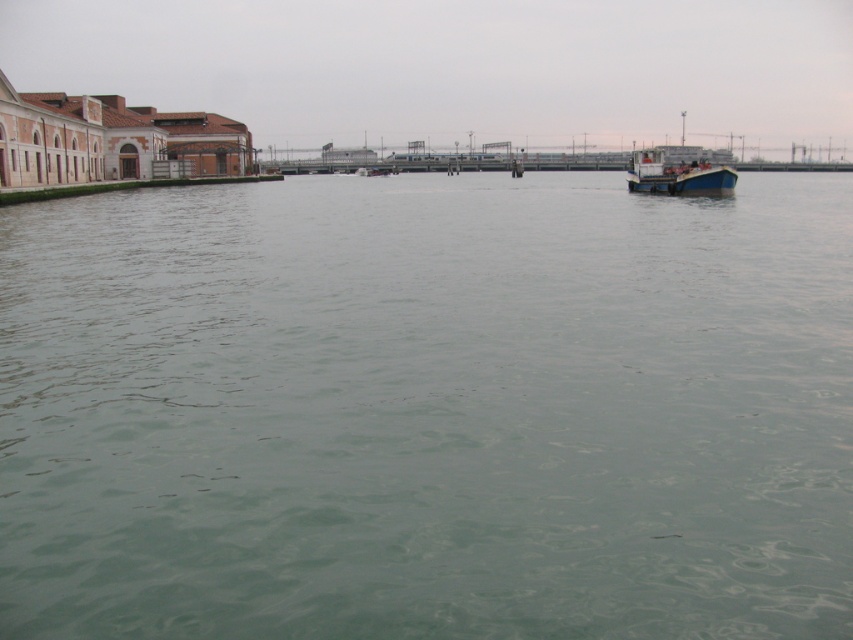
Question: Can you confirm if green water at center is thinner than wooden boat at right?

Choices:
 (A) no
 (B) yes

Answer: (A)

Question: Can you confirm if green water at center is positioned above wooden boat at right?

Choices:
 (A) yes
 (B) no

Answer: (B)

Question: Which of the following is the farthest from the observer?

Choices:
 (A) (722, 186)
 (B) (473, 557)

Answer: (A)

Question: Is green water at center closer to the viewer compared to wooden boat at right?

Choices:
 (A) yes
 (B) no

Answer: (A)